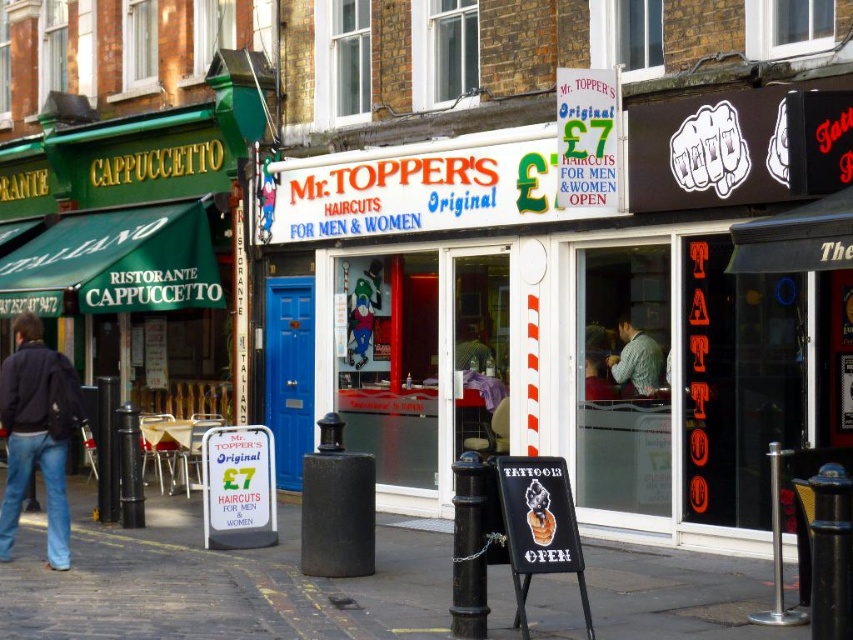
Question: Which object is the farthest from the smooth concrete pavement at center?

Choices:
 (A) dark blue jacket at lower left
 (B) knitted green sweater at center

Answer: (B)

Question: Based on their relative distances, which object is nearer to the smooth concrete pavement at center?

Choices:
 (A) knitted green sweater at center
 (B) dark blue jacket at lower left

Answer: (B)

Question: Is smooth concrete pavement at center bigger than knitted green sweater at center?

Choices:
 (A) no
 (B) yes

Answer: (A)

Question: Is smooth concrete pavement at center thinner than dark blue jacket at lower left?

Choices:
 (A) no
 (B) yes

Answer: (B)

Question: Can you confirm if smooth concrete pavement at center is positioned to the left of knitted green sweater at center?

Choices:
 (A) yes
 (B) no

Answer: (A)

Question: Which object appears farthest from the camera in this image?

Choices:
 (A) smooth concrete pavement at center
 (B) knitted green sweater at center
 (C) dark blue jacket at lower left

Answer: (B)